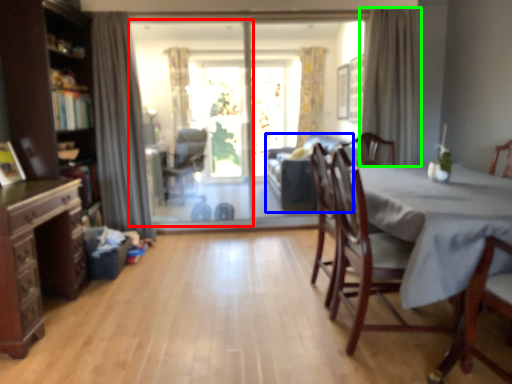
Question: Which object is positioned closest to screen door (highlighted by a red box)? Select from couch (highlighted by a blue box) and curtain (highlighted by a green box).

Choices:
 (A) couch
 (B) curtain

Answer: (A)